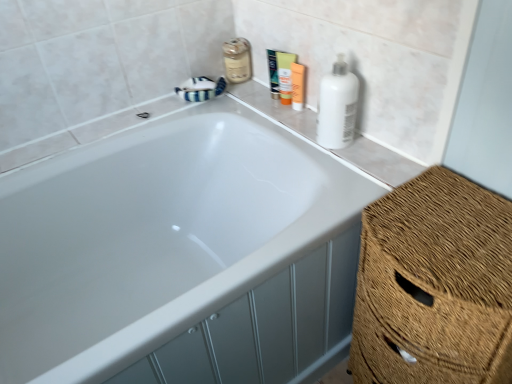
Question: Is white glossy bathtub at upper center inside the boundaries of white matte bottle at upper right, or outside?

Choices:
 (A) inside
 (B) outside

Answer: (B)

Question: From a real-world perspective, is white glossy bathtub at upper center physically located above or below white matte bottle at upper right?

Choices:
 (A) above
 (B) below

Answer: (B)

Question: Estimate the real-world distances between objects in this image. Which object is farther from the white glossy bathtub at upper center?

Choices:
 (A) woven straw basket at right
 (B) orange matte lotion at upper center, which is the 3th toiletry in left-to-right order
 (C) matte glass mouthwash at upper center
 (D) white matte bottle at upper right
 (E) green plastic tube at upper center, which is the 3th toiletry in right-to-left order

Answer: (C)

Question: Estimate the real-world distances between objects in this image. Which object is closer to the white matte bottle at upper right?

Choices:
 (A) green plastic tube at upper center, which is the 3th toiletry in right-to-left order
 (B) white glossy bathtub at upper center
 (C) matte orange tube at upper center, the second toiletry when ordered from left to right
 (D) matte glass mouthwash at upper center
 (E) orange matte lotion at upper center, which is counted as the 1th toiletry, starting from the right

Answer: (E)